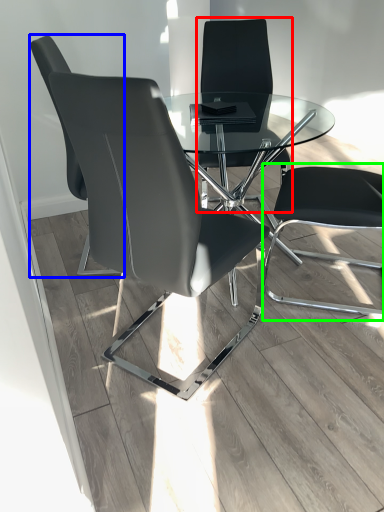
Question: Based on their relative distances, which object is nearer to chair (highlighted by a red box)? Choose from chair (highlighted by a blue box) and computer chair (highlighted by a green box).

Choices:
 (A) chair
 (B) computer chair

Answer: (B)